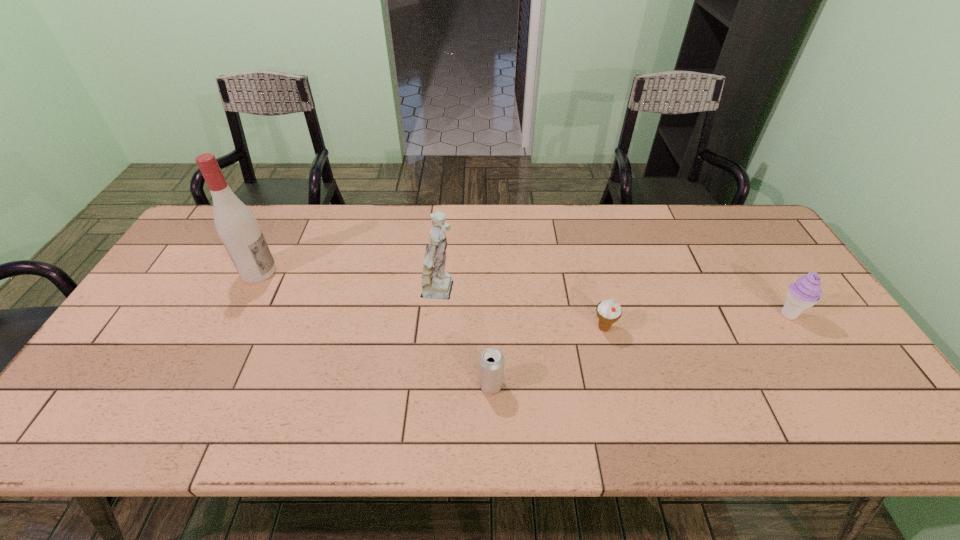
Identify which object is located as the third nearest to the third tallest object. Please provide its 2D coordinates. Your answer should be formatted as a tuple, i.e. [(x, y)], where the tuple contains the x and y coordinates of a point satisfying the conditions above.

[(437, 284)]

Identify the location of free space in the image that satisfies the following two spatial constraints: 1. on the front-facing side of the second tallest object; 2. on the right side of the shorter icecream. (439, 328).

Find the location of a particular element. This screenshot has height=540, width=960. vacant space that satisfies the following two spatial constraints: 1. on the label of the beer can; 2. on the right side of the leftmost object is located at coordinates (203, 384).

Where is `free location that satisfies the following two spatial constraints: 1. on the back side of the shorter icecream; 2. on the front-facing side of the fourth object from right to left`? free location that satisfies the following two spatial constraints: 1. on the back side of the shorter icecream; 2. on the front-facing side of the fourth object from right to left is located at coordinates (595, 293).

Where is `vacant space that satisfies the following two spatial constraints: 1. on the front-facing side of the shorter icecream; 2. on the right side of the figurine`? The image size is (960, 540). vacant space that satisfies the following two spatial constraints: 1. on the front-facing side of the shorter icecream; 2. on the right side of the figurine is located at coordinates (439, 328).

The height and width of the screenshot is (540, 960). Find the location of `vacant region that satisfies the following two spatial constraints: 1. on the back side of the beer can; 2. on the front-facing side of the second tallest object`. vacant region that satisfies the following two spatial constraints: 1. on the back side of the beer can; 2. on the front-facing side of the second tallest object is located at coordinates (489, 293).

Where is `vacant space that satisfies the following two spatial constraints: 1. on the back side of the right icecream; 2. on the left side of the left icecream`? vacant space that satisfies the following two spatial constraints: 1. on the back side of the right icecream; 2. on the left side of the left icecream is located at coordinates (601, 315).

You are a GUI agent. You are given a task and a screenshot of the screen. Output one action in this format:
    pyautogui.click(x=<x>, y=<y>)
    Task: Click on the free location that satisfies the following two spatial constraints: 1. on the front-facing side of the fourth object from right to left; 2. on the left side of the nearest object
    Image resolution: width=960 pixels, height=540 pixels.
    Given the screenshot: What is the action you would take?
    pyautogui.click(x=434, y=384)

At what (x,y) coordinates should I click in order to perform the action: click on free space in the image that satisfies the following two spatial constraints: 1. on the front-facing side of the right icecream; 2. on the left side of the figurine. Please return your answer as a coordinate pair (x, y). Looking at the image, I should click on (440, 315).